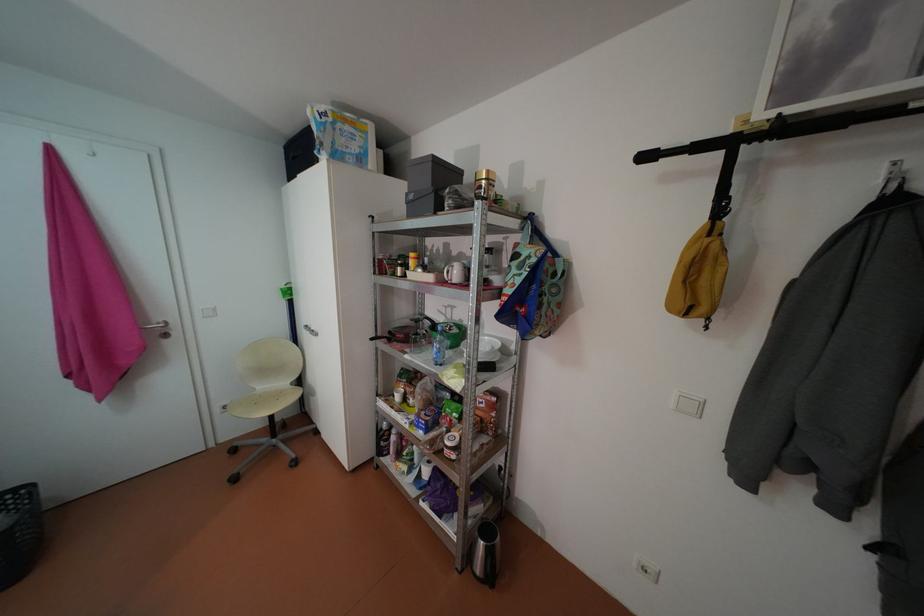
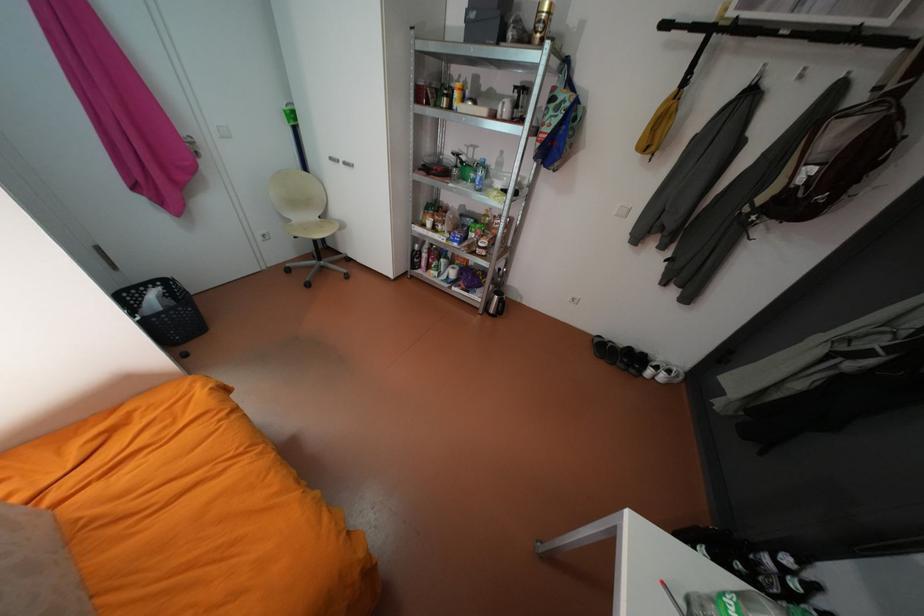
The point at (463, 557) is marked in the first image. Where is the corresponding point in the second image?

(487, 308)